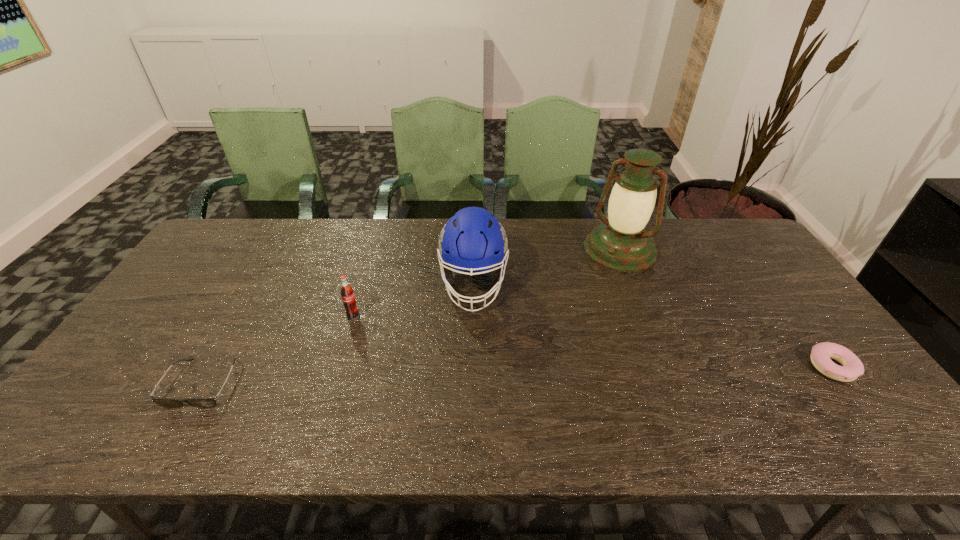
Where is `blank region between the rightmost object and the third object from right to left`? This screenshot has width=960, height=540. blank region between the rightmost object and the third object from right to left is located at coordinates (653, 326).

Locate an element on the screen. The height and width of the screenshot is (540, 960). free space between the third tallest object and the rightmost object is located at coordinates (592, 342).

What are the coordinates of `vacant space that's between the doughnut and the second object from right to left` in the screenshot? It's located at (726, 308).

This screenshot has height=540, width=960. Identify the location of free space that is in between the leftmost object and the football helmet. (338, 334).

Locate an element on the screen. free space between the third shortest object and the third object from right to left is located at coordinates (413, 300).

Where is `free space between the soda bottle and the second tallest object`? free space between the soda bottle and the second tallest object is located at coordinates (413, 300).

Find the location of a particular element. Image resolution: width=960 pixels, height=540 pixels. vacant point located between the second tallest object and the third shortest object is located at coordinates (413, 300).

Identify the location of blank region between the doughnut and the fourth shortest object. This screenshot has height=540, width=960. (653, 326).

Locate an element on the screen. The height and width of the screenshot is (540, 960). vacant point located between the doughnut and the third shortest object is located at coordinates (592, 342).

Locate an element on the screen. vacant area that lies between the doughnut and the soda bottle is located at coordinates (592, 342).